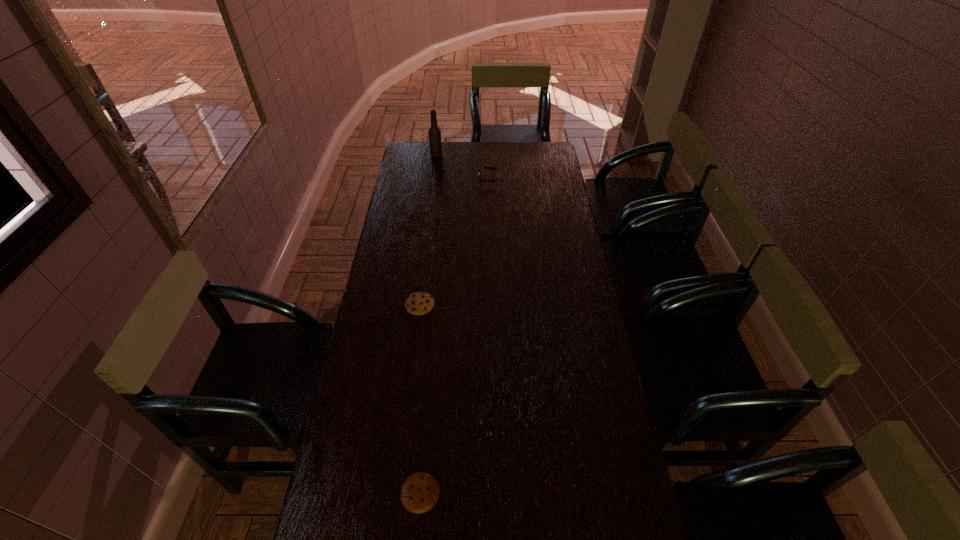
You are a GUI agent. You are given a task and a screenshot of the screen. Output one action in this format:
    pyautogui.click(x=<x>, y=<y>)
    Task: Click on the tallest object
    
    Given the screenshot: What is the action you would take?
    434,132

Where is `beer bottle`? Image resolution: width=960 pixels, height=540 pixels. beer bottle is located at coordinates (434, 132).

Where is `the rightmost object`? the rightmost object is located at coordinates (491, 168).

What are the coordinates of `sunglasses` in the screenshot? It's located at (491, 168).

Identify the location of the farther cookie. (419, 303).

Locate an element on the screen. Image resolution: width=960 pixels, height=540 pixels. the taller cookie is located at coordinates (419, 303).

The width and height of the screenshot is (960, 540). I want to click on the nearest object, so click(419, 493).

At what (x,y) coordinates should I click in order to perform the action: click on the shortest object. Please return your answer as a coordinate pair (x, y). This screenshot has height=540, width=960. Looking at the image, I should click on (419, 493).

You are a GUI agent. You are given a task and a screenshot of the screen. Output one action in this format:
    pyautogui.click(x=<x>, y=<y>)
    Task: Click on the blank area located 0.150m on the side of the tallest object with the label
    This screenshot has height=540, width=960.
    Given the screenshot: What is the action you would take?
    pyautogui.click(x=470, y=155)

Where is `free spot located on the front-facing side of the third nearest object`? This screenshot has width=960, height=540. free spot located on the front-facing side of the third nearest object is located at coordinates (445, 179).